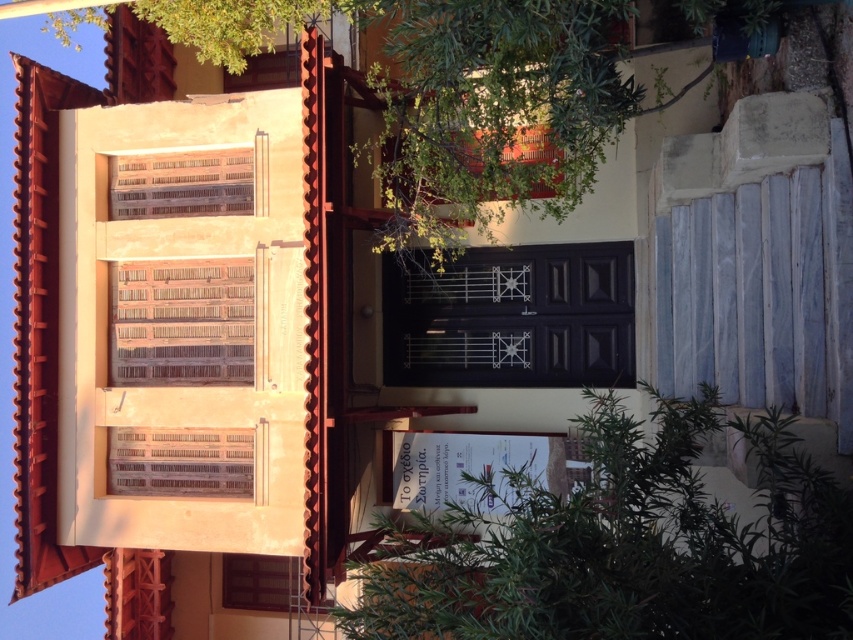
Question: Does green leafy plant at center have a larger size compared to matte wooden window at upper left?

Choices:
 (A) yes
 (B) no

Answer: (B)

Question: Based on their relative distances, which object is nearer to the wooden slats at upper left?

Choices:
 (A) green leafy plant at center
 (B) matte wooden window at upper left
 (C) white marble stairs at right
 (D) black matte door at center

Answer: (B)

Question: Is green leafy plant at center smaller than black matte door at center?

Choices:
 (A) no
 (B) yes

Answer: (B)

Question: Among these points, which one is farthest from the camera?

Choices:
 (A) (386, 323)
 (B) (218, 172)

Answer: (A)

Question: Among these points, which one is farthest from the camera?

Choices:
 (A) (194, 284)
 (B) (519, 525)

Answer: (A)

Question: Does green leafy plant at center appear under matte wooden window at upper left?

Choices:
 (A) no
 (B) yes

Answer: (A)